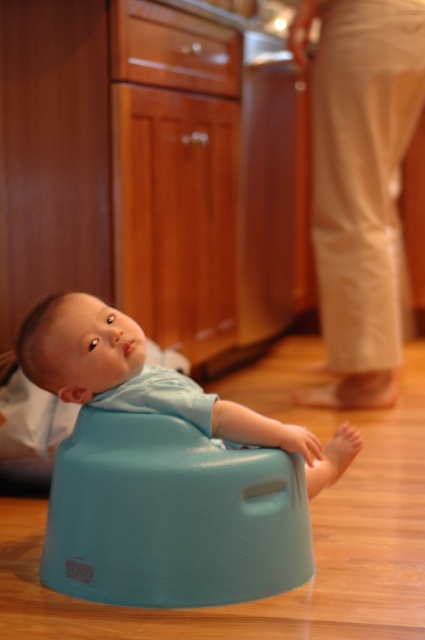
Question: In this image, where is matte plastic bumbo seat at lower center located relative to blue rubber baby seat at center?

Choices:
 (A) below
 (B) above

Answer: (A)

Question: Which object is closer to the camera taking this photo?

Choices:
 (A) matte plastic bumbo seat at lower center
 (B) blue rubber baby seat at center

Answer: (A)

Question: Which point is farther to the camera?

Choices:
 (A) (244, 579)
 (B) (78, 317)

Answer: (B)

Question: Which object appears farthest from the camera in this image?

Choices:
 (A) blue rubber baby seat at center
 (B) matte plastic bumbo seat at lower center

Answer: (A)

Question: Observing the image, what is the correct spatial positioning of matte plastic bumbo seat at lower center in reference to blue rubber baby seat at center?

Choices:
 (A) above
 (B) below

Answer: (B)

Question: Can you confirm if matte plastic bumbo seat at lower center is positioned below blue rubber baby seat at center?

Choices:
 (A) no
 (B) yes

Answer: (B)